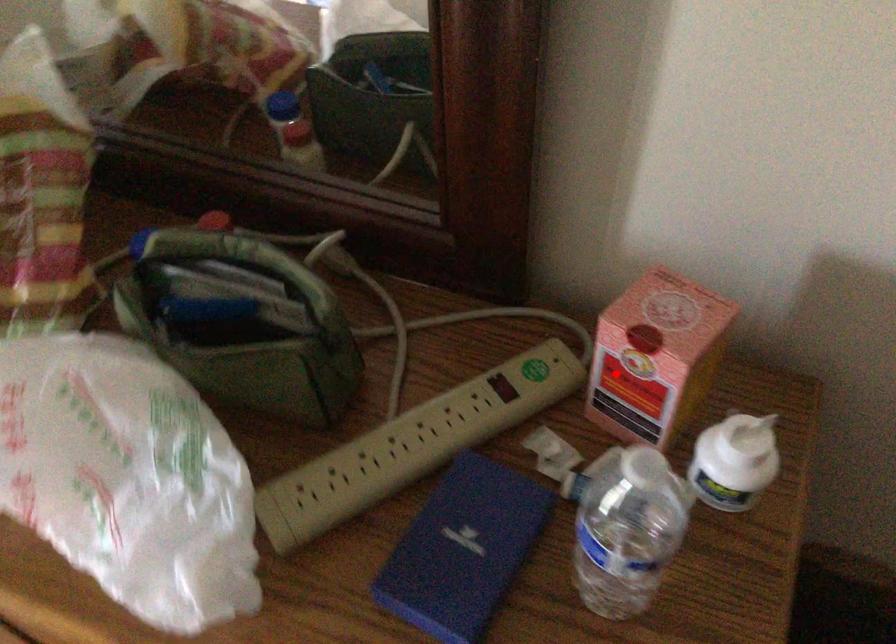
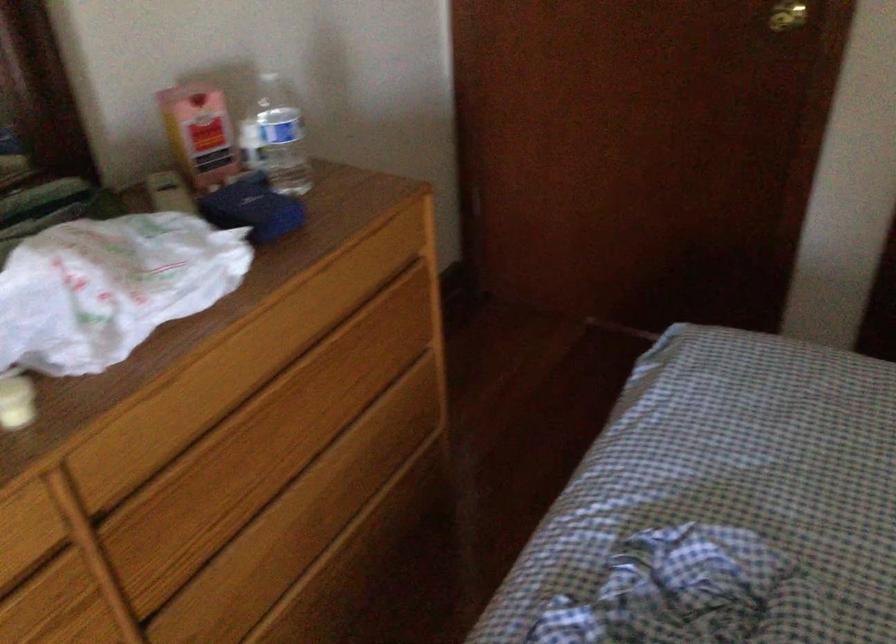
Find the pixel in the second image that matches the highlighted location in the first image.

(200, 134)